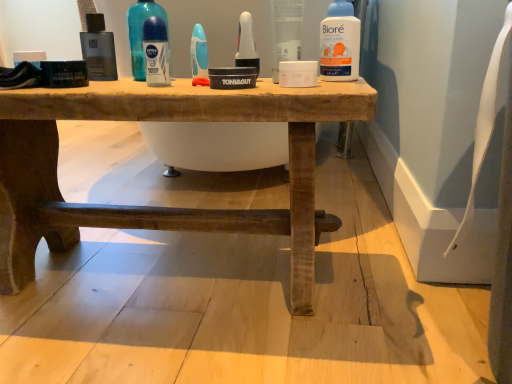
This screenshot has height=384, width=512. Find the location of `free space in front of blue glossy deodorant at upper center, the second cleaning product from the front`. free space in front of blue glossy deodorant at upper center, the second cleaning product from the front is located at coordinates (121, 83).